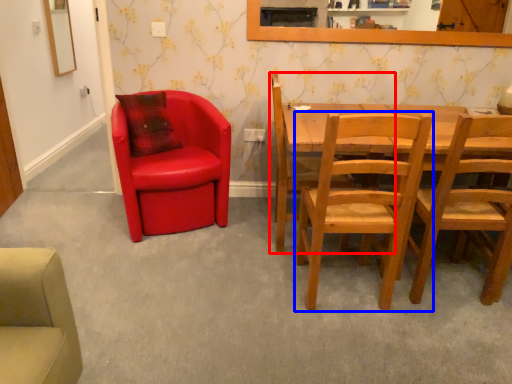
Question: Which of the following is the farthest to the observer, chair (highlighted by a red box) or chair (highlighted by a blue box)?

Choices:
 (A) chair
 (B) chair

Answer: (A)